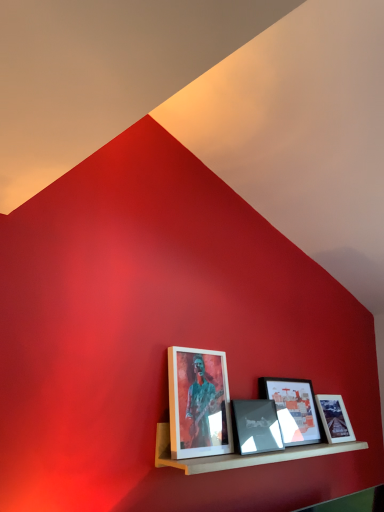
Question: In which direction should I rotate to look at matte glass picture frame at center, placed as the fourth picture frame when sorted from left to right?

Choices:
 (A) left
 (B) right

Answer: (B)

Question: From the image's perspective, is matte white picture frame at center, which is the fourth picture frame in right-to-left order, under matte black picture frame at center, the 2th picture frame viewed from the left?

Choices:
 (A) no
 (B) yes

Answer: (A)

Question: Is the depth of matte white picture frame at center, which appears as the 1th picture frame when viewed from the left, greater than that of matte black picture frame at center, the 2th picture frame viewed from the left?

Choices:
 (A) no
 (B) yes

Answer: (A)

Question: Considering the relative sizes of matte white picture frame at center, which appears as the 1th picture frame when viewed from the left, and matte black picture frame at center, the 2th picture frame viewed from the left, in the image provided, is matte white picture frame at center, which appears as the 1th picture frame when viewed from the left, shorter than matte black picture frame at center, the 2th picture frame viewed from the left,?

Choices:
 (A) no
 (B) yes

Answer: (A)

Question: Is matte white picture frame at center, which is the fourth picture frame in right-to-left order, oriented away from matte black picture frame at center, the 2th picture frame viewed from the left?

Choices:
 (A) yes
 (B) no

Answer: (B)

Question: Is matte white picture frame at center, which appears as the 1th picture frame when viewed from the left, closer to camera compared to matte black picture frame at center, the third picture frame in the right-to-left sequence?

Choices:
 (A) no
 (B) yes

Answer: (B)

Question: Can you confirm if matte white picture frame at center, which appears as the 1th picture frame when viewed from the left, is bigger than matte black picture frame at center, the 2th picture frame viewed from the left?

Choices:
 (A) yes
 (B) no

Answer: (A)

Question: Is matte black picture frame at center, the second picture frame from the right, far away from wooden shelf at lower center?

Choices:
 (A) yes
 (B) no

Answer: (B)

Question: Does matte black picture frame at center, which is counted as the 3th picture frame, starting from the left, come in front of wooden shelf at lower center?

Choices:
 (A) yes
 (B) no

Answer: (B)

Question: Could you tell me if matte black picture frame at center, which is counted as the 3th picture frame, starting from the left, is turned towards wooden shelf at lower center?

Choices:
 (A) yes
 (B) no

Answer: (A)

Question: Is matte black picture frame at center, the second picture frame from the right, shorter than wooden shelf at lower center?

Choices:
 (A) yes
 (B) no

Answer: (B)

Question: Does matte black picture frame at center, the second picture frame from the right, have a greater width compared to wooden shelf at lower center?

Choices:
 (A) yes
 (B) no

Answer: (B)

Question: Is matte black picture frame at center, the second picture frame from the right, behind wooden shelf at lower center?

Choices:
 (A) no
 (B) yes

Answer: (B)

Question: Is matte black picture frame at center, the second picture frame from the right, smaller than matte black picture frame at center, the third picture frame in the right-to-left sequence?

Choices:
 (A) no
 (B) yes

Answer: (A)